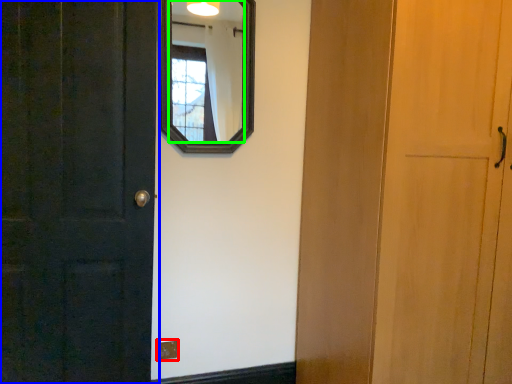
Question: Which object is the farthest from electric outlet (highlighted by a red box)? Choose among these: door (highlighted by a blue box) or mirror (highlighted by a green box).

Choices:
 (A) door
 (B) mirror

Answer: (B)